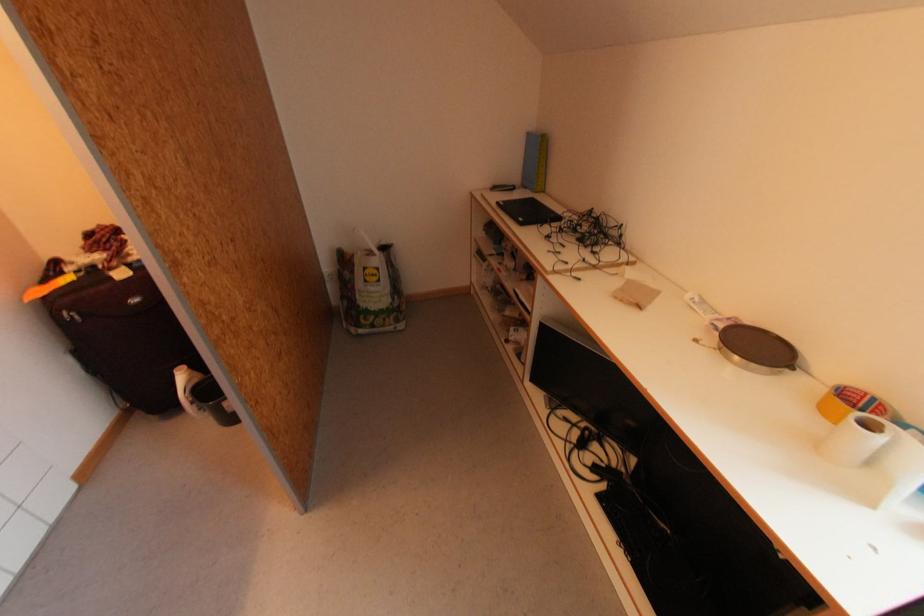
Find where to lift the yellow tape roll. Please return your answer as a coordinate pair (x, y).

(850, 403)